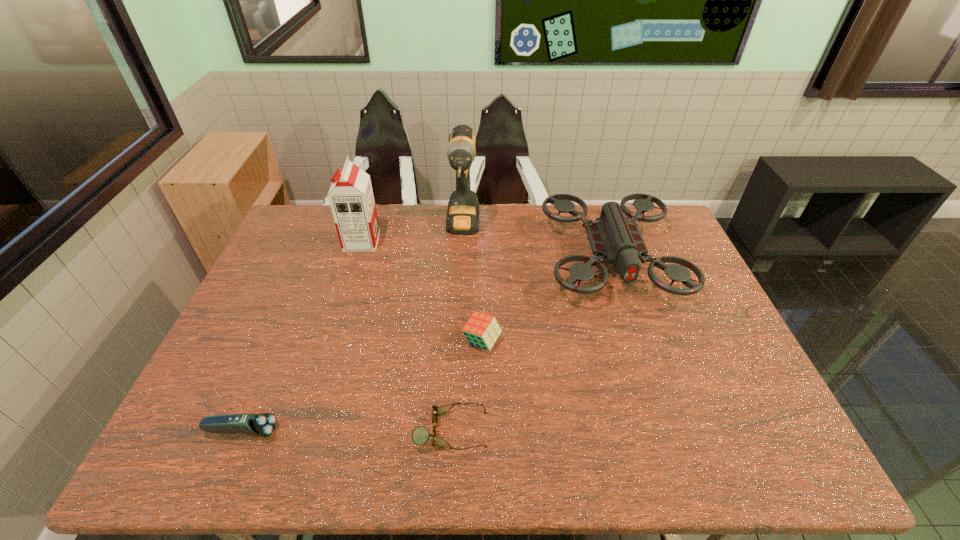
Identify the location of drill. (462, 218).

Find the location of a particular element. The width and height of the screenshot is (960, 540). soya milk is located at coordinates (351, 199).

In order to click on the third tallest object in this screenshot , I will do `click(611, 238)`.

Find the location of `drone`. drone is located at coordinates (611, 238).

This screenshot has height=540, width=960. Find the location of `the third shortest object`. the third shortest object is located at coordinates (482, 330).

In order to click on cube in this screenshot , I will do `click(482, 330)`.

In order to click on the second shortest object in this screenshot , I will do `click(264, 424)`.

Locate an element on the screen. spectacles is located at coordinates (420, 435).

You are a GUI agent. You are given a task and a screenshot of the screen. Output one action in this format:
    pyautogui.click(x=<x>, y=<y>)
    Task: Click on the vacant space situated with the drill bit of the drill facing forward
    
    Given the screenshot: What is the action you would take?
    pyautogui.click(x=458, y=338)

Identify the location of free space located on the front of the soya milk. The image size is (960, 540). (355, 262).